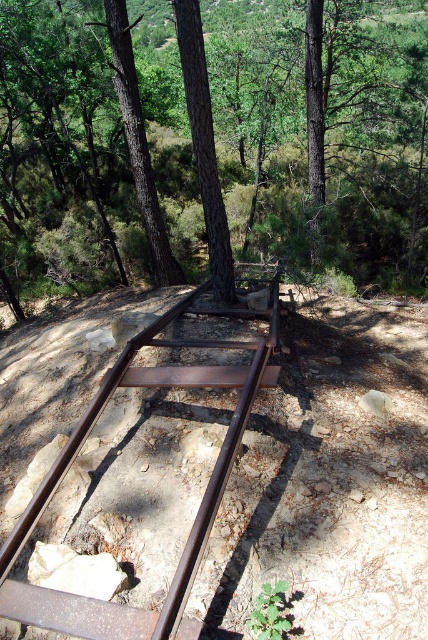
Question: Among these points, which one is nearest to the camera?

Choices:
 (A) (324, 104)
 (B) (202, 307)
 (C) (183, 42)
 (D) (145, 232)

Answer: (C)

Question: Which of the following is the closest to the observer?

Choices:
 (A) rusty metal train track at center
 (B) brown textured wood at upper center

Answer: (A)

Question: Which of the following is the farthest from the observer?

Choices:
 (A) (273, 337)
 (B) (184, 35)
 (C) (118, 4)
 (D) (297, 4)

Answer: (D)

Question: Is green leafy trees at upper center to the right of rusty metal train track at center from the viewer's perspective?

Choices:
 (A) no
 (B) yes

Answer: (B)

Question: Is brown wood tree at center to the left of brown textured wood at upper center from the viewer's perspective?

Choices:
 (A) no
 (B) yes

Answer: (A)

Question: Is green leafy trees at upper center positioned in front of brown wood tree at center?

Choices:
 (A) yes
 (B) no

Answer: (B)